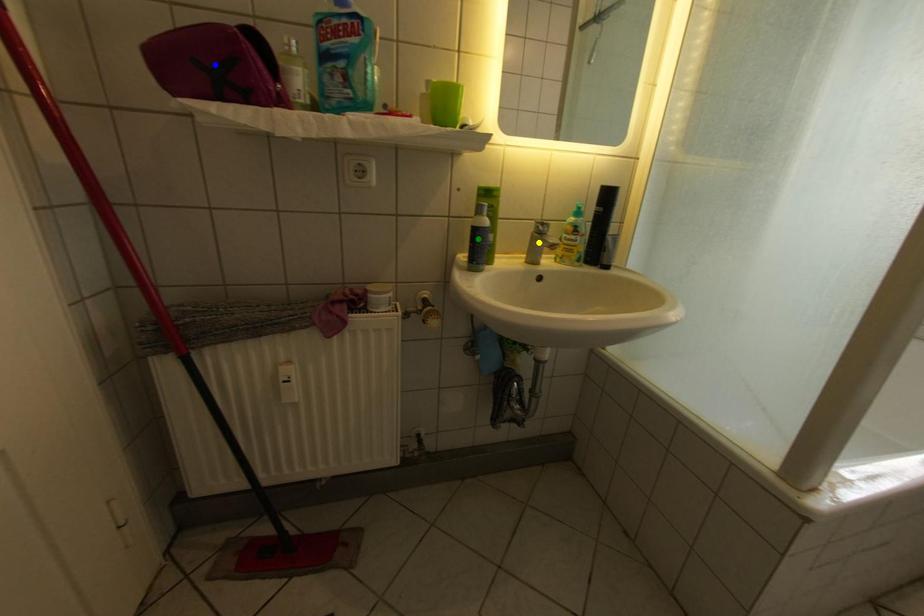
Order these from farthest to nearest:
green point | blue point | yellow point

yellow point → green point → blue point